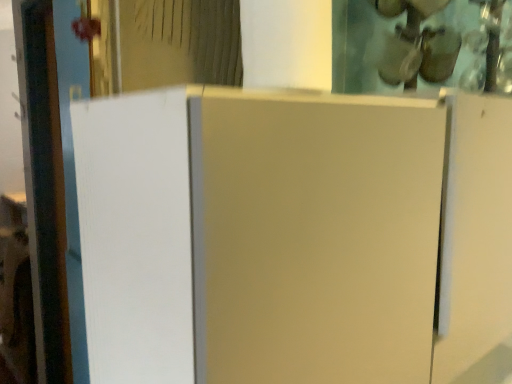
This screenshot has height=384, width=512. What do you see at coordinates (258, 236) in the screenshot?
I see `white matte refrigerator at center` at bounding box center [258, 236].

In order to click on white matte refrigerator at center in this screenshot , I will do `click(258, 236)`.

Where is `white matte refrigerator at center`? white matte refrigerator at center is located at coordinates (258, 236).